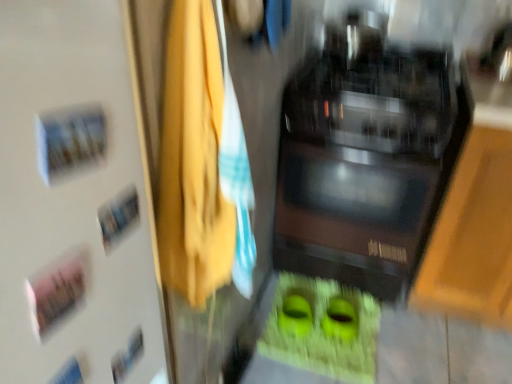
Question: Visually, is yellow fabric at center positioned to the left or to the right of black glossy microwave at center?

Choices:
 (A) left
 (B) right

Answer: (A)

Question: From a real-world perspective, is yellow fabric at center physically located above or below black glossy microwave at center?

Choices:
 (A) above
 (B) below

Answer: (A)

Question: Which object is positioned closest to the black glossy microwave at center?

Choices:
 (A) yellow fabric at center
 (B) white matte door at upper left

Answer: (A)

Question: Estimate the real-world distances between objects in this image. Which object is closer to the white matte door at upper left?

Choices:
 (A) yellow fabric at center
 (B) black glossy microwave at center

Answer: (A)